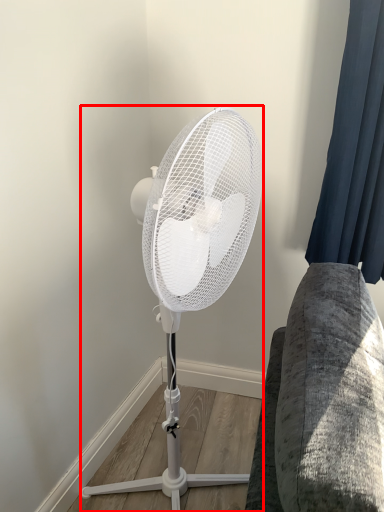
Question: From the image's perspective, what is the correct spatial positioning of mechanical fan (annotated by the red box) in reference to curtain?

Choices:
 (A) below
 (B) above

Answer: (A)